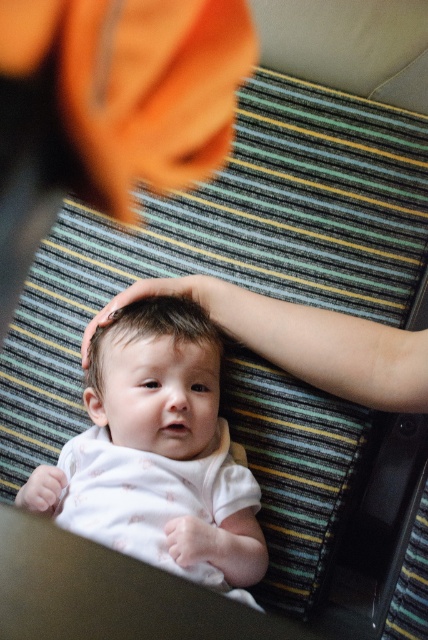
You are a photographer setting up for a baby photoshoot. You have a white soft baby at center and a smooth white baby head at center in the frame. Based on the scene description, which object should you focus on to ensure the baby is in the best possible position for the photo?

The white soft baby at center is taller than the smooth white baby head at center, so focusing on the white soft baby at center would ensure the baby is in the best possible position for the photo.

You are a photographer trying to capture the baby in focus. Since the white soft baby at center and the smooth white baby head at center are both in the scene, which one should you focus on to ensure it appears sharp in the photo?

The white soft baby at center is closer to the viewer than the smooth white baby head at center, so focusing on the white soft baby at center will ensure it appears sharp.

You are a photographer trying to capture the baby in the image. You notice the white soft baby at center and the smooth white baby head at center. Which one is located below the other?

The white soft baby at center is positioned under the smooth white baby head at center, so the white soft baby at center is below the smooth white baby head at center.